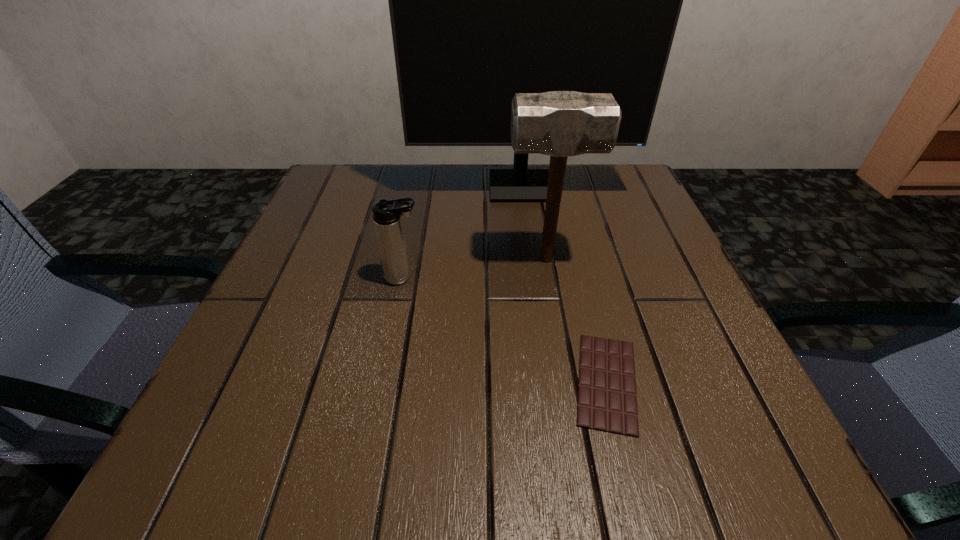
Image resolution: width=960 pixels, height=540 pixels. In order to click on computer monitor in this screenshot , I will do `click(486, 0)`.

The height and width of the screenshot is (540, 960). I want to click on the tallest object, so click(x=486, y=0).

Identify the location of the second tallest object. (559, 123).

At what (x,y) coordinates should I click in order to perform the action: click on the third tallest object. Please return your answer as a coordinate pair (x, y). Looking at the image, I should click on (387, 213).

You are a GUI agent. You are given a task and a screenshot of the screen. Output one action in this format:
    pyautogui.click(x=<x>, y=<y>)
    Task: Click on the chocolate bar
    This screenshot has height=540, width=960.
    Given the screenshot: What is the action you would take?
    pyautogui.click(x=607, y=400)

This screenshot has height=540, width=960. I want to click on the nearest object, so coord(607,400).

I want to click on vacant position located on the front-facing side of the tallest object, so click(x=532, y=280).

This screenshot has width=960, height=540. In order to click on free space located 0.190m on the striking face of the second tallest object in this screenshot , I will do coord(408,259).

The image size is (960, 540). Find the location of `vacant space situated 0.210m on the striking face of the second tallest object`. vacant space situated 0.210m on the striking face of the second tallest object is located at coordinates (397, 259).

The image size is (960, 540). I want to click on vacant space located 0.340m on the striking face of the second tallest object, so tap(330, 259).